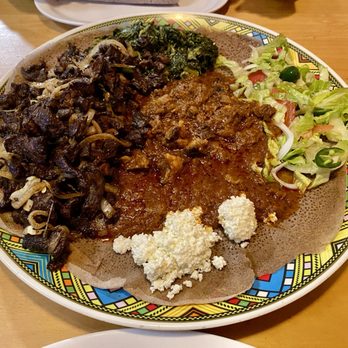
This screenshot has height=348, width=348. In order to click on white outer edge of plate in this screenshot , I will do `click(266, 309)`.